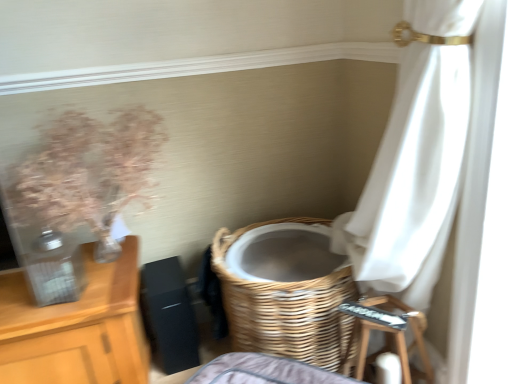
Question: From a real-world perspective, is wooden step stool at lower right physically located above or below translucent glass vase at left?

Choices:
 (A) above
 (B) below

Answer: (B)

Question: Based on their positions, is wooden step stool at lower right located to the left or right of translucent glass vase at left?

Choices:
 (A) left
 (B) right

Answer: (B)

Question: Which is farther from the woven wood basket at lower center?

Choices:
 (A) wooden step stool at lower right
 (B) translucent glass vase at left

Answer: (B)

Question: Estimate the real-world distances between objects in this image. Which object is closer to the translucent glass vase at left?

Choices:
 (A) wooden step stool at lower right
 (B) woven wood basket at lower center

Answer: (B)